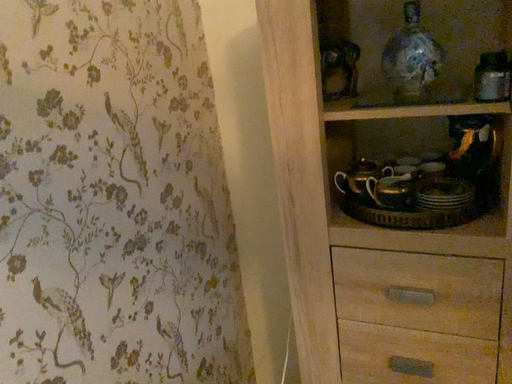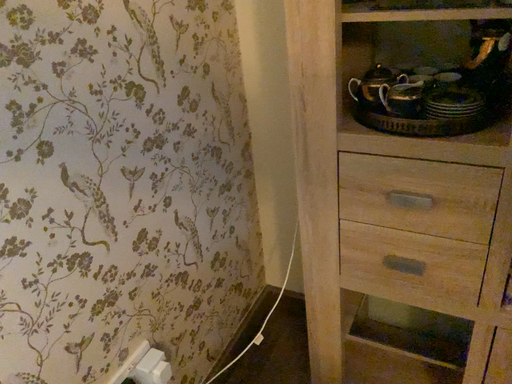
Question: How did the camera likely rotate when shooting the video?

Choices:
 (A) rotated upward
 (B) rotated downward

Answer: (B)